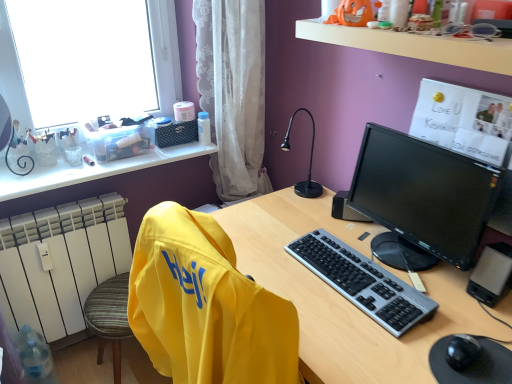
The image size is (512, 384). Find the location of `vacant space underneath black plastic keyboard at center (from a real-world perspective)`. vacant space underneath black plastic keyboard at center (from a real-world perspective) is located at coordinates (369, 282).